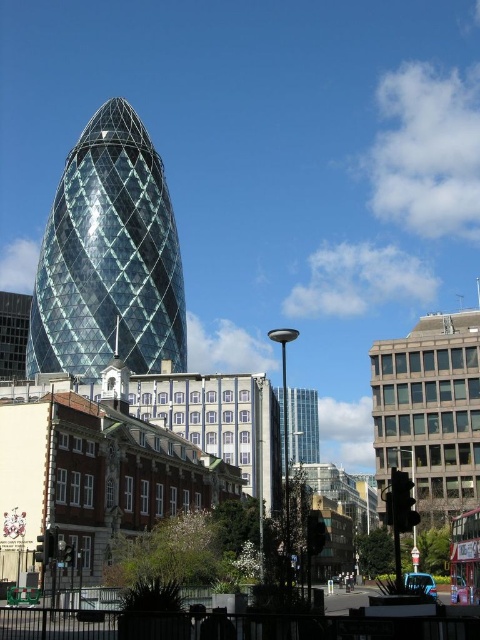
Question: Can you confirm if transparent glass tower at center is positioned above glassy metallic skyscraper at center?

Choices:
 (A) no
 (B) yes

Answer: (B)

Question: Observing the image, what is the correct spatial positioning of transparent glass tower at center in reference to glassy metallic skyscraper at center?

Choices:
 (A) right
 (B) left

Answer: (B)

Question: Which object is farther from the camera taking this photo?

Choices:
 (A) glassy metallic skyscraper at center
 (B) transparent glass tower at center

Answer: (B)

Question: Does transparent glass tower at center appear on the left side of glassy metallic skyscraper at center?

Choices:
 (A) yes
 (B) no

Answer: (A)